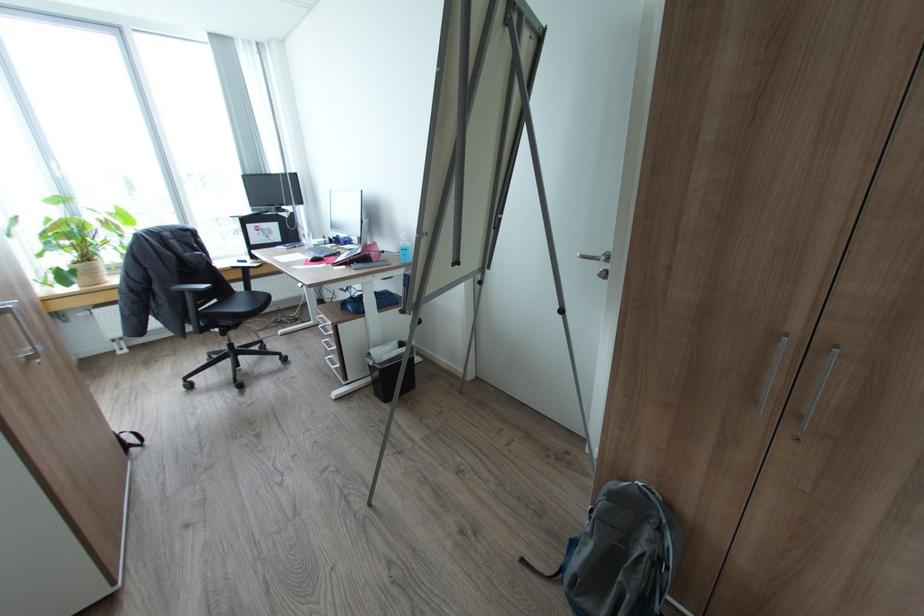
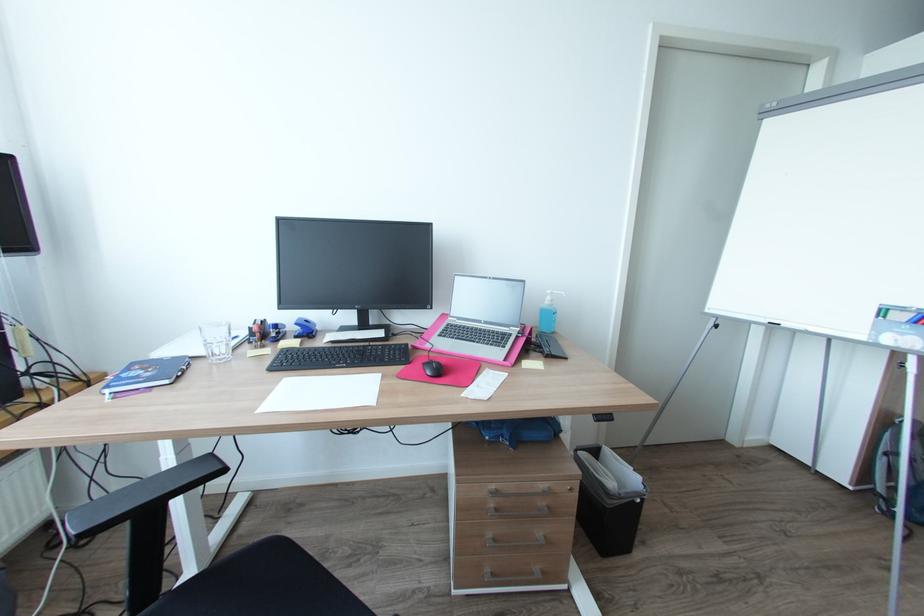
Find the pixel in the second image that matches (x=325, y=315) in the first image.

(497, 487)